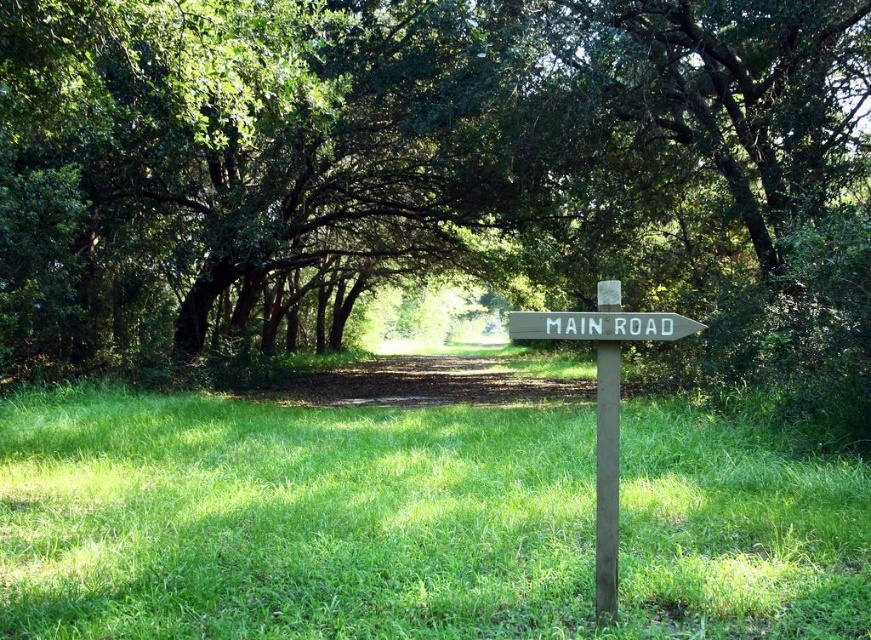
Is wooden signpost at center further to the viewer compared to white wooden sign at center?

No, wooden signpost at center is in front of white wooden sign at center.

Does wooden signpost at center have a larger size compared to white wooden sign at center?

Yes, wooden signpost at center is bigger than white wooden sign at center.

Identify the location of wooden signpost at center. [604, 403].

Does green leafy tree at center have a greater height compared to green wood pole at center?

Yes.

Who is more forward, (396, 28) or (609, 410)?

Point (609, 410) is in front.

You are a GUI agent. You are given a task and a screenshot of the screen. Output one action in this format:
    pyautogui.click(x=<x>, y=<y>)
    Task: Click on the green leafy tree at center
    The width and height of the screenshot is (871, 640).
    Given the screenshot: What is the action you would take?
    pyautogui.click(x=399, y=147)

Locate an element on the screen. The width and height of the screenshot is (871, 640). green leafy tree at center is located at coordinates (399, 147).

Does point (278, 35) come in front of point (564, 326)?

No.

Does green leafy tree at center have a smaller size compared to white wooden sign at center?

No, green leafy tree at center is not smaller than white wooden sign at center.

Measure the distance between green leafy tree at center and camera.

A distance of 6.24 meters exists between green leafy tree at center and camera.

The height and width of the screenshot is (640, 871). I want to click on green leafy tree at center, so [x=399, y=147].